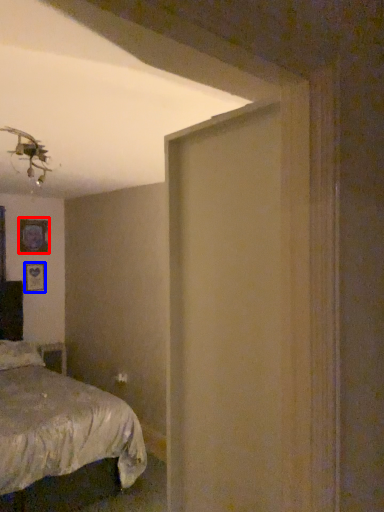
Question: Which object is closer to the camera taking this photo, picture frame (highlighted by a red box) or picture frame (highlighted by a blue box)?

Choices:
 (A) picture frame
 (B) picture frame

Answer: (A)